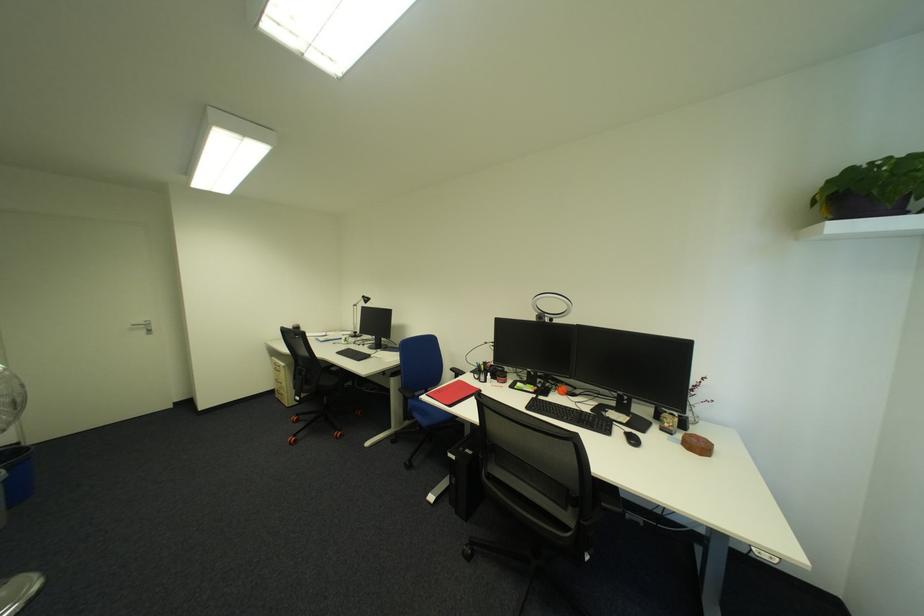
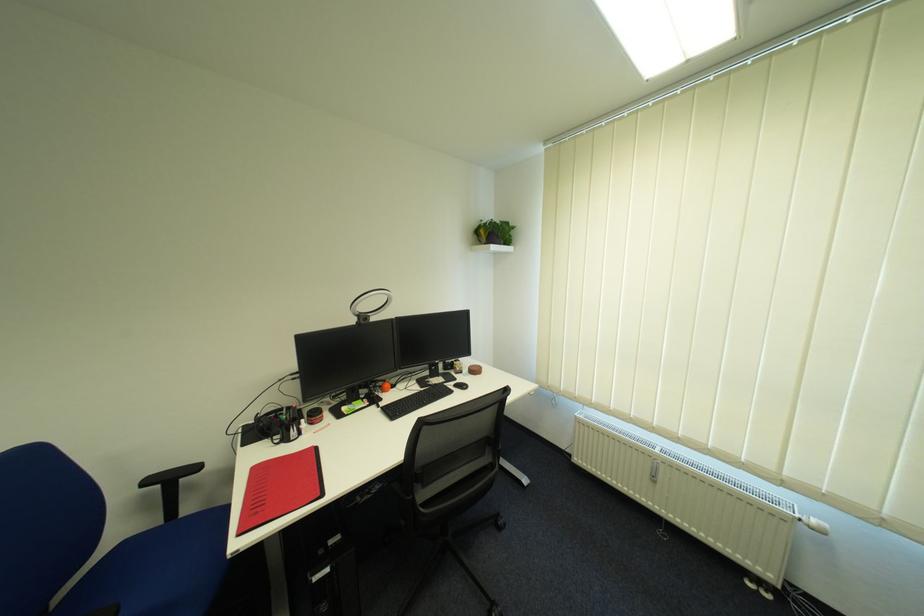
Where in the second image is the point corresponding to pixel 462 370 from the first image?

(157, 483)